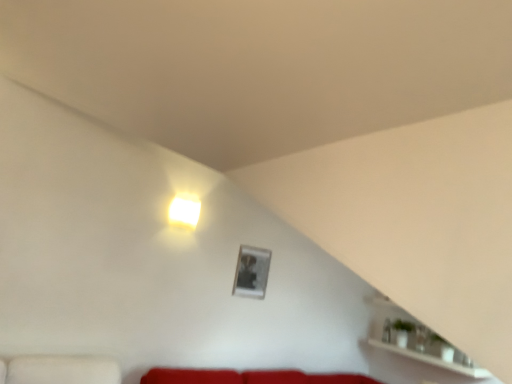
Question: From the image's perspective, is metallic silver picture frame at upper center located above white glossy shelf at lower right?

Choices:
 (A) no
 (B) yes

Answer: (B)

Question: Is white glossy shelf at lower right located within metallic silver picture frame at upper center?

Choices:
 (A) no
 (B) yes

Answer: (A)

Question: Is the position of metallic silver picture frame at upper center more distant than that of white glossy shelf at lower right?

Choices:
 (A) yes
 (B) no

Answer: (A)

Question: Considering the relative sizes of metallic silver picture frame at upper center and white glossy shelf at lower right in the image provided, is metallic silver picture frame at upper center shorter than white glossy shelf at lower right?

Choices:
 (A) yes
 (B) no

Answer: (B)

Question: Considering the relative sizes of metallic silver picture frame at upper center and white glossy shelf at lower right in the image provided, is metallic silver picture frame at upper center bigger than white glossy shelf at lower right?

Choices:
 (A) no
 (B) yes

Answer: (A)

Question: Considering the relative positions of metallic silver picture frame at upper center and white glossy shelf at lower right in the image provided, is metallic silver picture frame at upper center in front of white glossy shelf at lower right?

Choices:
 (A) yes
 (B) no

Answer: (B)

Question: From a real-world perspective, is white glossy shelf at lower right located higher than metallic silver picture frame at upper center?

Choices:
 (A) yes
 (B) no

Answer: (B)

Question: Is white glossy shelf at lower right oriented towards metallic silver picture frame at upper center?

Choices:
 (A) no
 (B) yes

Answer: (B)

Question: Considering the relative sizes of white glossy shelf at lower right and metallic silver picture frame at upper center in the image provided, is white glossy shelf at lower right smaller than metallic silver picture frame at upper center?

Choices:
 (A) no
 (B) yes

Answer: (A)

Question: Is the position of white glossy shelf at lower right less distant than that of metallic silver picture frame at upper center?

Choices:
 (A) no
 (B) yes

Answer: (B)

Question: Is white glossy shelf at lower right wider than metallic silver picture frame at upper center?

Choices:
 (A) yes
 (B) no

Answer: (A)

Question: Considering the relative positions of white glossy shelf at lower right and metallic silver picture frame at upper center in the image provided, is white glossy shelf at lower right to the right of metallic silver picture frame at upper center from the viewer's perspective?

Choices:
 (A) yes
 (B) no

Answer: (A)

Question: Is white glossy cube at upper center thinner than white glossy shelf at lower right?

Choices:
 (A) yes
 (B) no

Answer: (A)